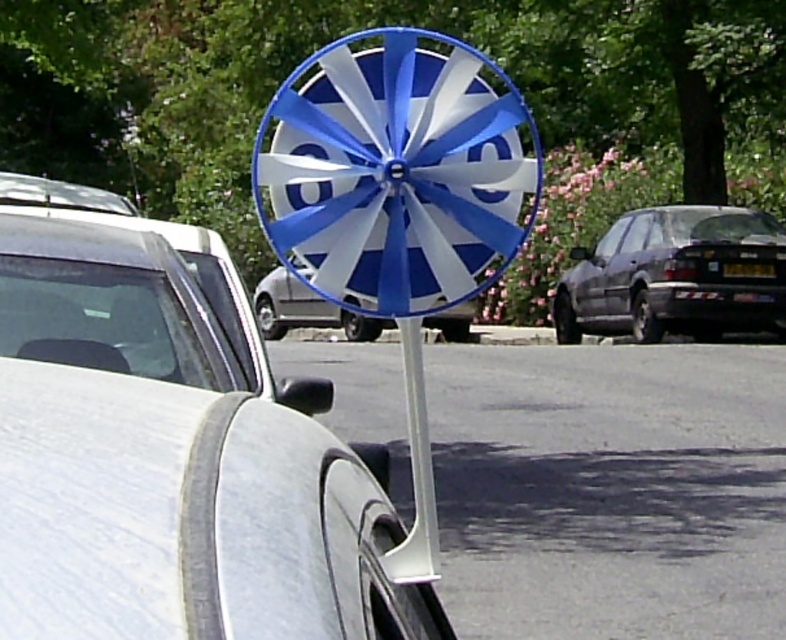
Is dark gray matte car at right behind metallic silver van at center?

Yes, dark gray matte car at right is further from the viewer.

Is point (586, 250) closer to camera compared to point (461, 320)?

Yes, it is.

Is point (671, 205) farther from camera compared to point (274, 326)?

No, (671, 205) is in front of (274, 326).

This screenshot has height=640, width=786. I want to click on dark gray matte car at right, so tap(674, 275).

Is white matte car at center smaller than metallic silver van at center?

Correct, white matte car at center occupies less space than metallic silver van at center.

Find the location of a particular element. This screenshot has width=786, height=640. white matte car at center is located at coordinates (171, 449).

Between point (399, 531) and point (283, 324), which one is positioned in front?

Point (399, 531)

The image size is (786, 640). I want to click on white matte car at center, so click(171, 449).

Between metallic silver van at center and black plastic license plate at center, which one is positioned higher?

black plastic license plate at center is higher up.

Is the position of metallic silver van at center less distant than that of black plastic license plate at center?

Yes.

In order to click on metallic silver van at center in this screenshot , I will do `click(305, 308)`.